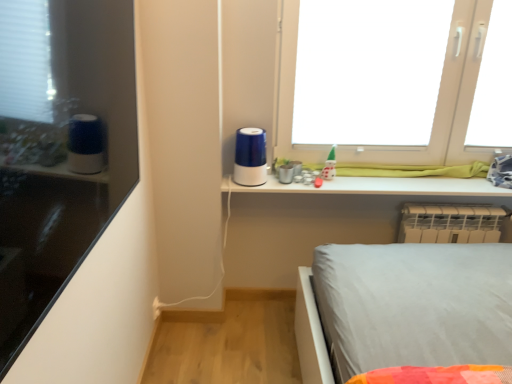
Question: Does white plastic radiator at lower right have a greater width compared to transparent plastic window screen at upper right?

Choices:
 (A) no
 (B) yes

Answer: (B)

Question: Is white plastic radiator at lower right taller than transparent plastic window screen at upper right?

Choices:
 (A) yes
 (B) no

Answer: (B)

Question: Does white plastic radiator at lower right lie in front of transparent plastic window screen at upper right?

Choices:
 (A) no
 (B) yes

Answer: (A)

Question: Is white plastic radiator at lower right not near transparent plastic window screen at upper right?

Choices:
 (A) yes
 (B) no

Answer: (B)

Question: Is white plastic radiator at lower right positioned with its back to transparent plastic window screen at upper right?

Choices:
 (A) no
 (B) yes

Answer: (A)

Question: Is transparent plastic window screen at upper right bigger or smaller than white plastic window at upper right?

Choices:
 (A) small
 (B) big

Answer: (A)

Question: Is transparent plastic window screen at upper right spatially inside white plastic window at upper right, or outside of it?

Choices:
 (A) outside
 (B) inside

Answer: (B)

Question: Is transparent plastic window screen at upper right wider or thinner than white plastic window at upper right?

Choices:
 (A) wide
 (B) thin

Answer: (B)

Question: Visually, is transparent plastic window screen at upper right positioned to the left or to the right of white plastic window at upper right?

Choices:
 (A) right
 (B) left

Answer: (A)

Question: Is matte black shelf at left inside or outside of green glossy toy at upper center?

Choices:
 (A) outside
 (B) inside

Answer: (A)

Question: Considering the positions of point (37, 336) and point (327, 170), is point (37, 336) closer or farther from the camera than point (327, 170)?

Choices:
 (A) closer
 (B) farther

Answer: (A)

Question: Looking at the image, does matte black shelf at left seem bigger or smaller compared to green glossy toy at upper center?

Choices:
 (A) small
 (B) big

Answer: (B)

Question: Is matte black shelf at left in front of or behind green glossy toy at upper center in the image?

Choices:
 (A) front
 (B) behind

Answer: (A)

Question: Considering the positions of matte black shelf at left and white plastic window at upper right in the image, is matte black shelf at left taller or shorter than white plastic window at upper right?

Choices:
 (A) tall
 (B) short

Answer: (B)

Question: Is matte black shelf at left in front of or behind white plastic window at upper right in the image?

Choices:
 (A) behind
 (B) front

Answer: (B)